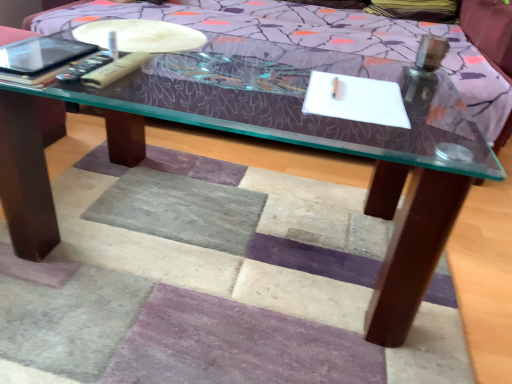
Find the location of a particular element. This screenshot has width=512, height=384. free space above matte black tablet at upper left (from a real-world perspective) is located at coordinates (35, 43).